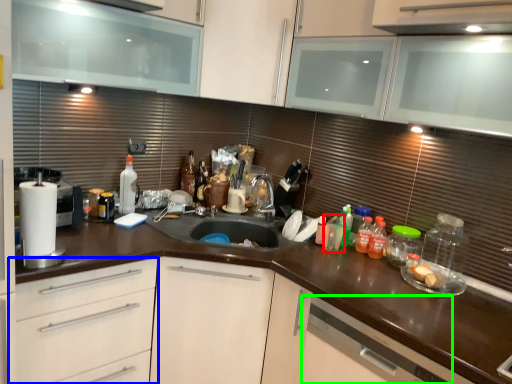
Question: Which is nearer to the bottle (highlighted by a red box)? drawer (highlighted by a blue box) or dish washer (highlighted by a green box).

Choices:
 (A) drawer
 (B) dish washer

Answer: (B)